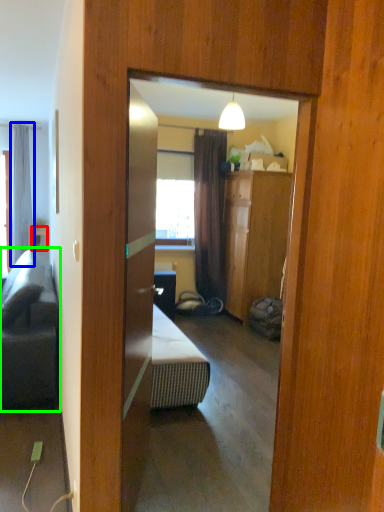
Question: Which object is the farthest from table (highlighted by a red box)? Choose among these: curtain (highlighted by a blue box) or studio couch (highlighted by a green box).

Choices:
 (A) curtain
 (B) studio couch

Answer: (B)